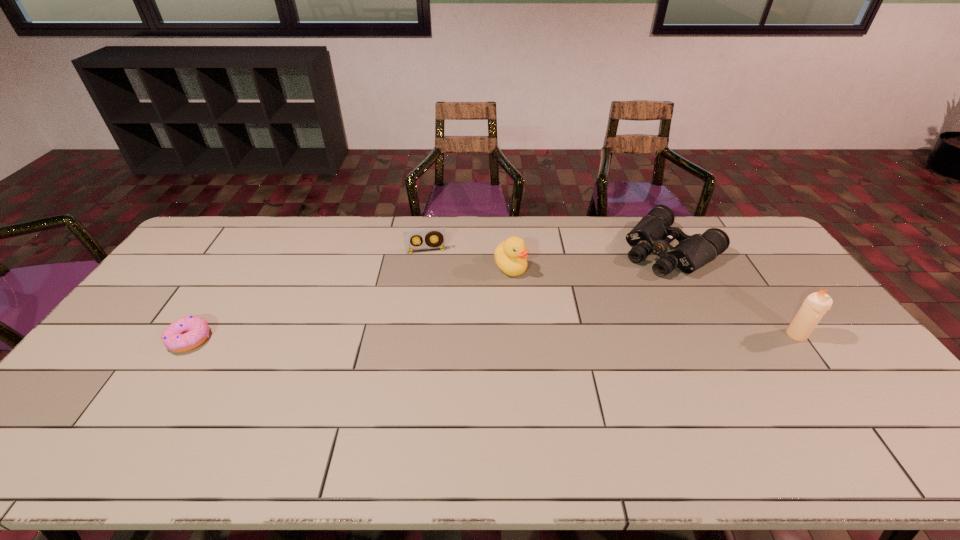
The width and height of the screenshot is (960, 540). What are the coordinates of `the leftmost object` in the screenshot? It's located at (186, 333).

Find the location of a particular element. doughnut is located at coordinates (186, 333).

I want to click on the rightmost object, so click(x=815, y=305).

The width and height of the screenshot is (960, 540). Identify the location of the tallest object. (815, 305).

What are the coordinates of `binoculars` in the screenshot? It's located at (652, 234).

I want to click on videotape, so click(x=410, y=236).

Locate an element on the screen. This screenshot has height=540, width=960. the third object from left to right is located at coordinates point(510,255).

Find the location of a particular element. the second tallest object is located at coordinates (510, 255).

Image resolution: width=960 pixels, height=540 pixels. In order to click on free space located 0.080m on the left of the doughnut in this screenshot , I will do `click(141, 339)`.

What are the coordinates of `vacant space located on the left of the candle` in the screenshot? It's located at (755, 335).